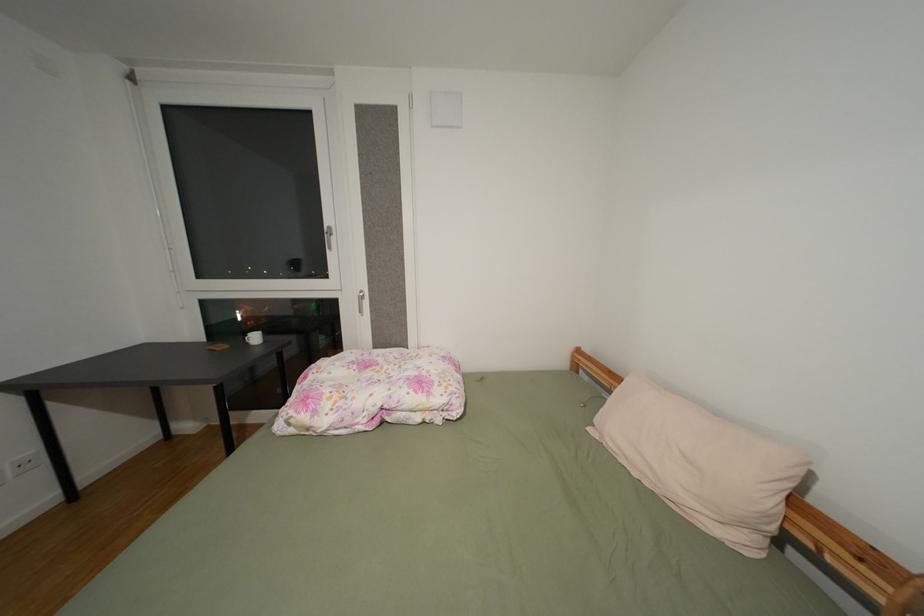
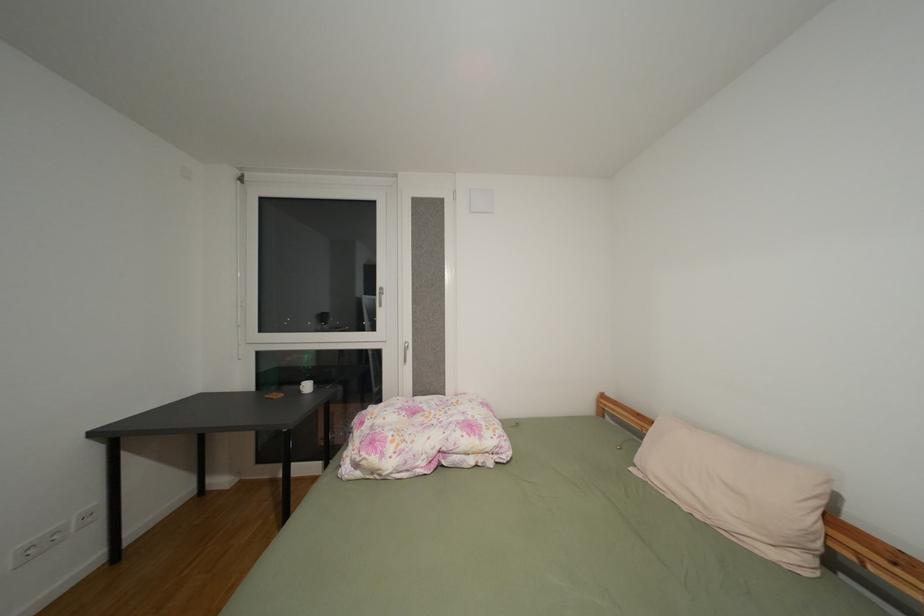
Question: How did the camera likely rotate?

Choices:
 (A) Left
 (B) Right
 (C) Up
 (D) Down

Answer: (C)